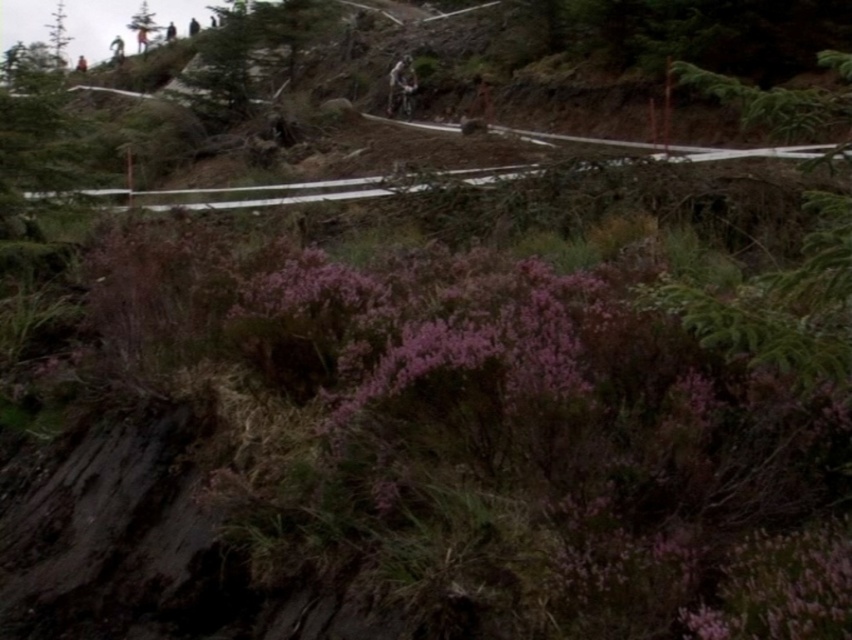
Locate an element on the screen. The width and height of the screenshot is (852, 640). green leafy tree at upper left is located at coordinates (56, 35).

In the scene shown: Who is taller, green leafy tree at upper left or green matte tree at upper left?

Standing taller between the two is green leafy tree at upper left.

Which is in front, point (52, 26) or point (135, 29)?

Point (135, 29)

You are a GUI agent. You are given a task and a screenshot of the screen. Output one action in this format:
    pyautogui.click(x=<x>, y=<y>)
    Task: Click on the green leafy tree at upper left
    The image size is (852, 640).
    Given the screenshot: What is the action you would take?
    pyautogui.click(x=56, y=35)

Does green leafy tree at upper right have a greater height compared to green leafy tree at upper left?

Incorrect, green leafy tree at upper right's height is not larger of green leafy tree at upper left's.

Describe the element at coordinates (784, 305) in the screenshot. This screenshot has width=852, height=640. I see `green leafy tree at upper right` at that location.

The width and height of the screenshot is (852, 640). What do you see at coordinates (784, 305) in the screenshot?
I see `green leafy tree at upper right` at bounding box center [784, 305].

Identify the location of green leafy tree at upper right. The width and height of the screenshot is (852, 640). (784, 305).

Who is lower down, green leafy tree at upper right or shiny metallic mountain bike at center?

green leafy tree at upper right

Between green leafy tree at upper right and shiny metallic mountain bike at center, which one has more height?

With more height is shiny metallic mountain bike at center.

Does point (712, 92) come farther from viewer compared to point (394, 109)?

No, it is not.

At what (x,y) coordinates should I click in order to perform the action: click on green leafy tree at upper right. Please return your answer as a coordinate pair (x, y). Image resolution: width=852 pixels, height=640 pixels. Looking at the image, I should click on (784, 305).